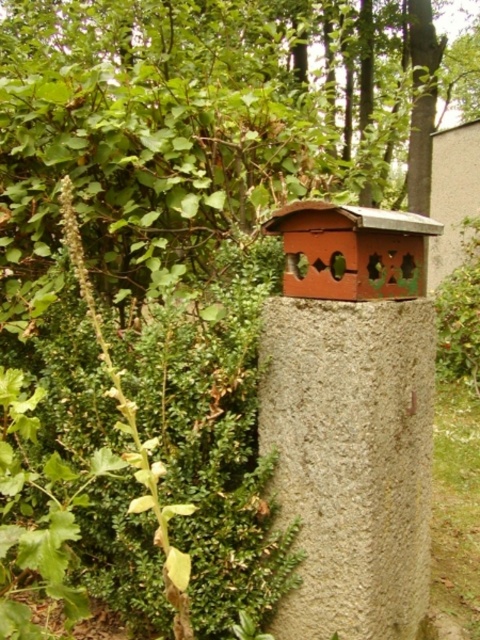
Who is lower down, green leafy tree at upper left or gray concrete post at center?

gray concrete post at center is below.

Between green leafy tree at upper left and gray concrete post at center, which one is positioned higher?

green leafy tree at upper left is above.

Identify the location of green leafy tree at upper left. (204, 125).